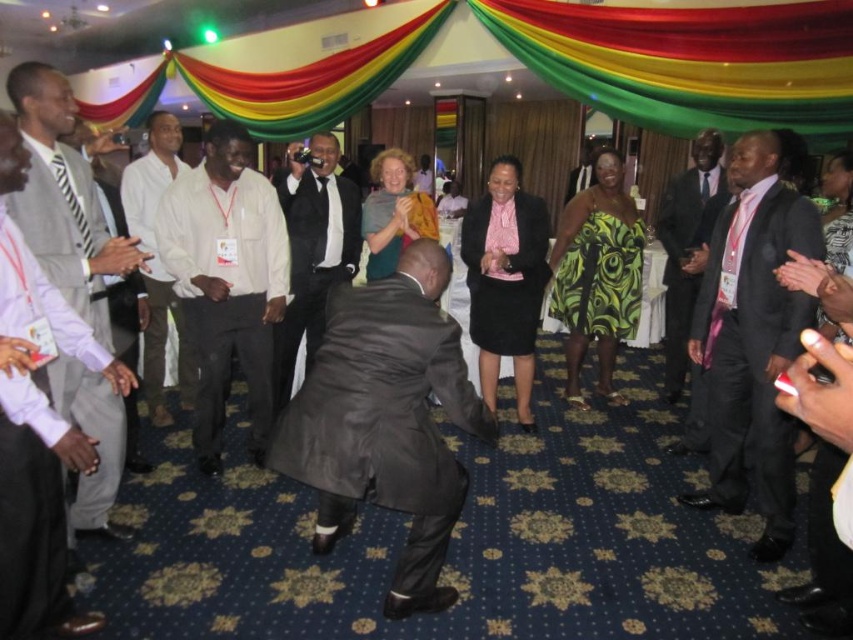
Question: Which of the following is the farthest from the observer?

Choices:
 (A) (13, 72)
 (B) (509, 301)
 (C) (396, 273)
 (D) (688, 292)

Answer: (D)

Question: Does black satin suit at center lie in front of dark gray suit at right?

Choices:
 (A) no
 (B) yes

Answer: (B)

Question: Which object appears farthest from the camera in this image?

Choices:
 (A) white matte shirt at center
 (B) dark gray suit at right
 (C) black satin suit at center

Answer: (B)

Question: Does white matte shirt at center appear on the left side of pink satin dress at center?

Choices:
 (A) yes
 (B) no

Answer: (A)

Question: Which point is farther from the camera taking this photo?

Choices:
 (A) (685, 179)
 (B) (184, 344)
 (C) (730, 333)
 (D) (311, 214)

Answer: (A)

Question: Is dark gray suit at center smaller than light gray suit at left?

Choices:
 (A) no
 (B) yes

Answer: (B)